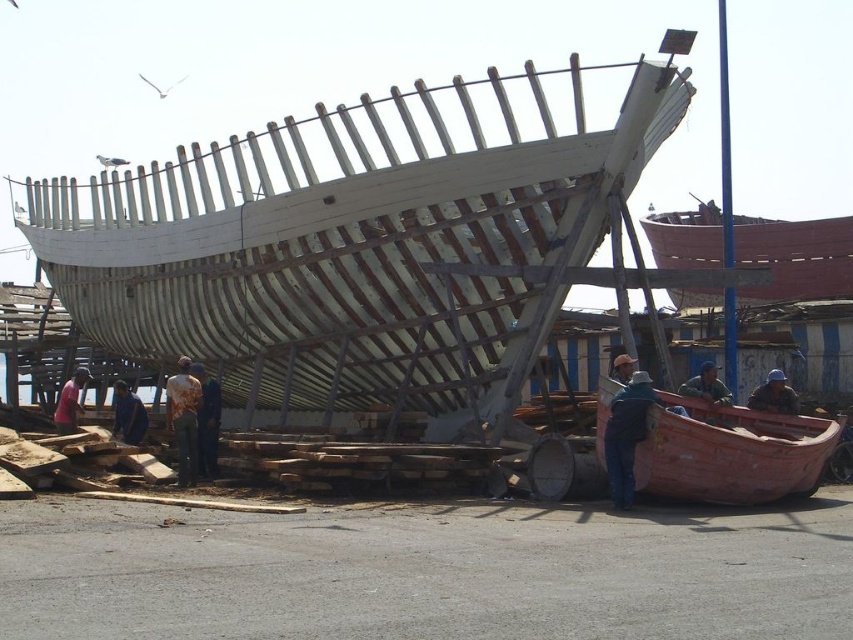
Question: Is rusty wooden boat at lower right smaller than worn fabric shirt at center?

Choices:
 (A) yes
 (B) no

Answer: (A)

Question: Is camouflage fabric shirt at center below brown leather jacket at lower left?

Choices:
 (A) no
 (B) yes

Answer: (A)

Question: Which of the following is the closest to the observer?

Choices:
 (A) matte pink shirt at left
 (B) brown leather hat at center
 (C) blue fabric cap at center

Answer: (B)

Question: Does brown leather jacket at lower left appear under matte pink shirt at left?

Choices:
 (A) no
 (B) yes

Answer: (A)

Question: Which point is closer to the camera taking this photo?

Choices:
 (A) (213, 429)
 (B) (671, 436)
 (C) (712, 397)

Answer: (B)

Question: Among these objects, which one is farthest from the camera?

Choices:
 (A) matte pink shirt at left
 (B) brown leather hat at center

Answer: (A)